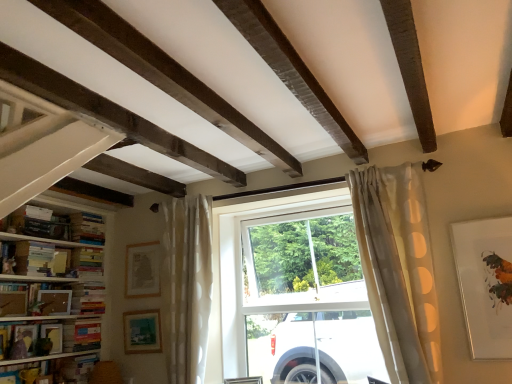
Question: Should I look upward or downward to see hardcover book at lower left, acting as the eighth book starting from the top?

Choices:
 (A) up
 (B) down

Answer: (B)

Question: From the image's perspective, would you say hardcover book at left, which is counted as the 2th book, starting from the bottom, is shown under matte wooden picture frame at lower left, the 2th picture frame when ordered from back to front?

Choices:
 (A) no
 (B) yes

Answer: (B)

Question: From a real-world perspective, is hardcover book at left, which appears as the 7th book when viewed from the top, physically above matte wooden picture frame at lower left, the 4th picture frame viewed from the left?

Choices:
 (A) yes
 (B) no

Answer: (A)

Question: Does hardcover book at left, which is counted as the 2th book, starting from the bottom, have a lesser width compared to matte wooden picture frame at lower left, the 2th picture frame when ordered from back to front?

Choices:
 (A) no
 (B) yes

Answer: (A)

Question: From a real-world perspective, is hardcover book at left, which is counted as the 2th book, starting from the bottom, located beneath matte wooden picture frame at lower left, the 2th picture frame when ordered from right to left?

Choices:
 (A) yes
 (B) no

Answer: (B)

Question: Is hardcover book at left, which is counted as the 2th book, starting from the bottom, oriented towards matte wooden picture frame at lower left, the 4th picture frame from the front?

Choices:
 (A) yes
 (B) no

Answer: (A)

Question: From the image's perspective, is hardcover book at left, which is counted as the 2th book, starting from the bottom, located above matte wooden picture frame at lower left, the 2th picture frame when ordered from back to front?

Choices:
 (A) yes
 (B) no

Answer: (B)

Question: From the image's perspective, is matte wooden picture frame at lower left, positioned as the fourth picture frame in right-to-left order, beneath hardcover book at lower left, acting as the first book starting from the bottom?

Choices:
 (A) yes
 (B) no

Answer: (B)

Question: Is matte wooden picture frame at lower left, the fourth picture frame when ordered from back to front, behind hardcover book at lower left, acting as the first book starting from the bottom?

Choices:
 (A) yes
 (B) no

Answer: (A)

Question: Does matte wooden picture frame at lower left, positioned as the fourth picture frame in right-to-left order, appear on the right side of hardcover book at lower left, acting as the first book starting from the bottom?

Choices:
 (A) yes
 (B) no

Answer: (A)

Question: From a real-world perspective, is matte wooden picture frame at lower left, which is counted as the second picture frame, starting from the left, located beneath hardcover book at lower left, acting as the first book starting from the bottom?

Choices:
 (A) no
 (B) yes

Answer: (A)

Question: Is matte wooden picture frame at lower left, positioned as the fourth picture frame in right-to-left order, next to hardcover book at lower left, acting as the eighth book starting from the top?

Choices:
 (A) no
 (B) yes

Answer: (A)

Question: Is matte wooden picture frame at lower left, which is counted as the second picture frame, starting from the left, at the left side of hardcover book at lower left, acting as the first book starting from the bottom?

Choices:
 (A) no
 (B) yes

Answer: (A)

Question: Does hardcover books at left, which is the 3th book in top-to-bottom order, appear on the left side of hardcover books at left, placed as the 4th book when sorted from top to bottom?

Choices:
 (A) no
 (B) yes

Answer: (B)